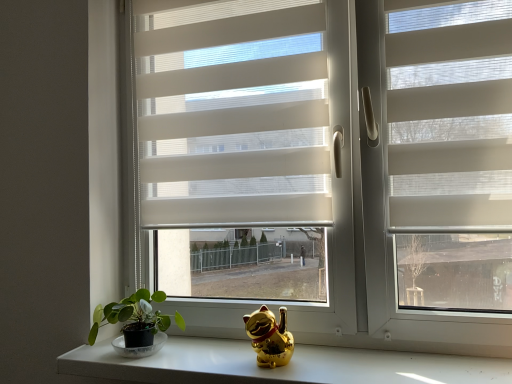
Question: Is gold metallic cat figurine at lower center not close to gold shiny cat at center?

Choices:
 (A) yes
 (B) no

Answer: (B)

Question: Can you confirm if gold metallic cat figurine at lower center is bigger than gold shiny cat at center?

Choices:
 (A) no
 (B) yes

Answer: (B)

Question: Could you tell me if gold metallic cat figurine at lower center is turned towards gold shiny cat at center?

Choices:
 (A) yes
 (B) no

Answer: (B)

Question: Is gold metallic cat figurine at lower center oriented away from gold shiny cat at center?

Choices:
 (A) no
 (B) yes

Answer: (A)

Question: Considering the relative sizes of gold metallic cat figurine at lower center and gold shiny cat at center in the image provided, is gold metallic cat figurine at lower center wider than gold shiny cat at center?

Choices:
 (A) yes
 (B) no

Answer: (A)

Question: From their relative heights in the image, would you say gold metallic cat figurine at lower center is taller or shorter than green matte plant at lower left?

Choices:
 (A) tall
 (B) short

Answer: (B)

Question: Would you say gold metallic cat figurine at lower center is to the left or to the right of green matte plant at lower left in the picture?

Choices:
 (A) right
 (B) left

Answer: (A)

Question: From a real-world perspective, is gold metallic cat figurine at lower center positioned above or below green matte plant at lower left?

Choices:
 (A) below
 (B) above

Answer: (A)

Question: Is gold metallic cat figurine at lower center in front of or behind green matte plant at lower left in the image?

Choices:
 (A) behind
 (B) front

Answer: (B)

Question: Considering the positions of green matte plant at lower left and gold shiny cat at center in the image, is green matte plant at lower left wider or thinner than gold shiny cat at center?

Choices:
 (A) thin
 (B) wide

Answer: (B)

Question: Would you say green matte plant at lower left is to the left or to the right of gold shiny cat at center in the picture?

Choices:
 (A) left
 (B) right

Answer: (A)

Question: Do you think green matte plant at lower left is within gold shiny cat at center, or outside of it?

Choices:
 (A) inside
 (B) outside

Answer: (B)

Question: Looking at the image, does green matte plant at lower left seem bigger or smaller compared to gold shiny cat at center?

Choices:
 (A) big
 (B) small

Answer: (A)

Question: Considering their positions, is white textured blinds at center located in front of or behind green matte plant at lower left?

Choices:
 (A) behind
 (B) front

Answer: (A)

Question: Looking at their shapes, would you say white textured blinds at center is wider or thinner than green matte plant at lower left?

Choices:
 (A) thin
 (B) wide

Answer: (A)